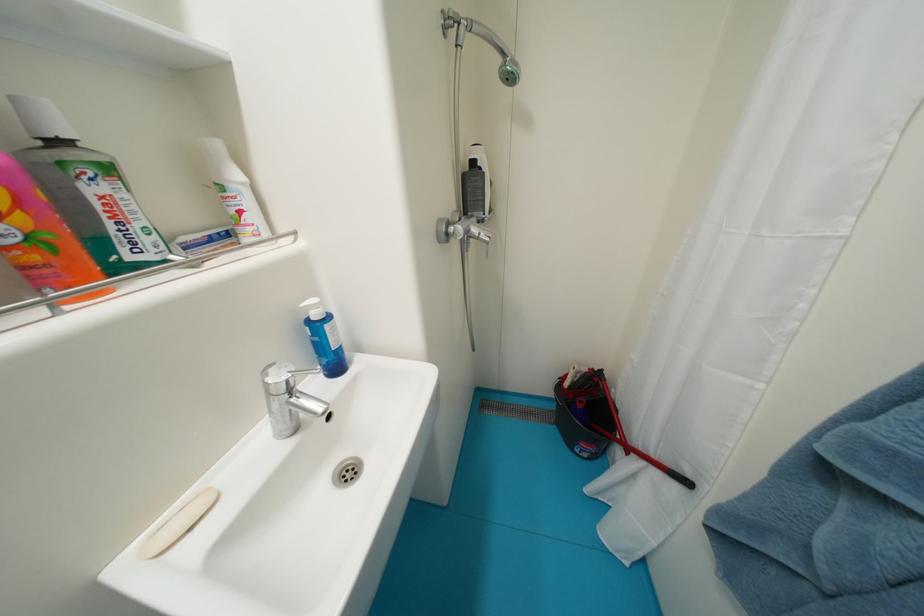
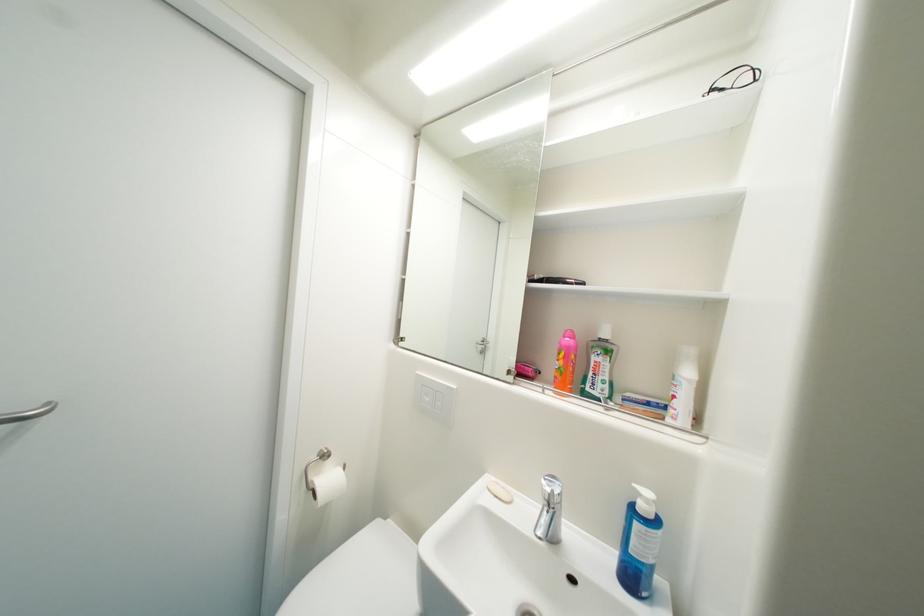
Find the pixel in the second image that matches [53,238] in the first image.

(569, 371)